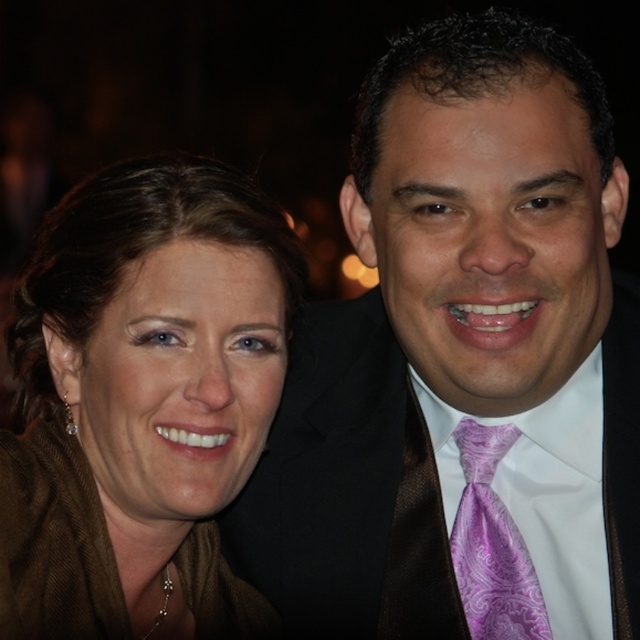
Question: Which point is farther from the camera taking this photo?

Choices:
 (A) (563, 573)
 (B) (451, 628)

Answer: (B)

Question: Can you confirm if purple satin tie at right is bigger than brown fabric at left?

Choices:
 (A) no
 (B) yes

Answer: (B)

Question: Which point appears farthest from the camera in this image?

Choices:
 (A) (560, 426)
 (B) (227, 364)

Answer: (A)

Question: Where is brown fabric at left located in relation to purple satin dress shirt at center in the image?

Choices:
 (A) right
 (B) left

Answer: (B)

Question: Which of the following is the closest to the observer?

Choices:
 (A) (573, 449)
 (B) (524, 248)
 (C) (76, 579)
 (D) (460, 528)

Answer: (B)

Question: Does purple satin tie at right have a smaller size compared to brown fabric at left?

Choices:
 (A) yes
 (B) no

Answer: (B)